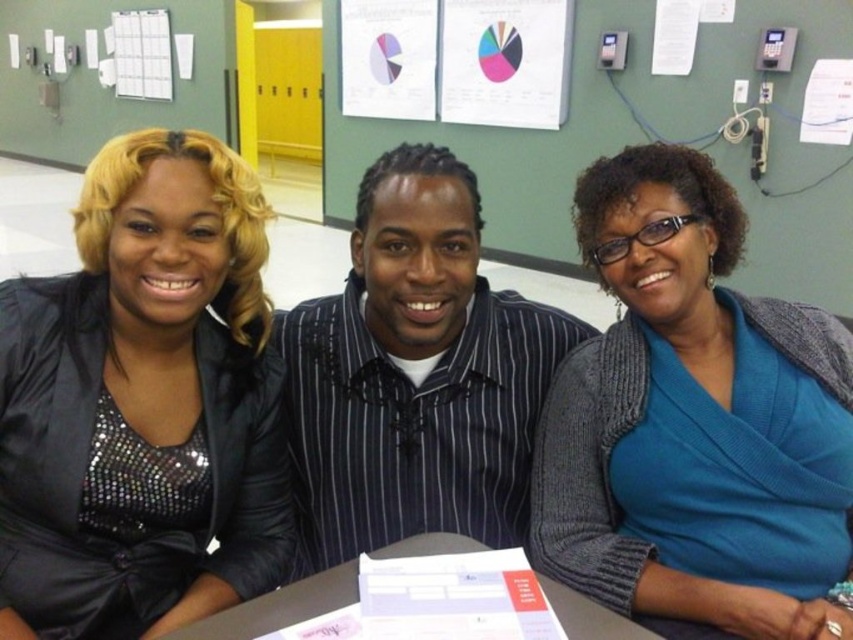
Which of these two, satin black jacket at left or black pinstripe shirt at center, stands shorter?

satin black jacket at left is shorter.

Which is more to the left, satin black jacket at left or black pinstripe shirt at center?

satin black jacket at left

Who is more forward, [260,481] or [408,348]?

Point [260,481]

This screenshot has width=853, height=640. I want to click on satin black jacket at left, so click(x=143, y=401).

Is blue knit sweater at center to the right of black pinstripe shirt at center from the viewer's perspective?

Yes, blue knit sweater at center is to the right of black pinstripe shirt at center.

Is blue knit sweater at center bigger than black pinstripe shirt at center?

Actually, blue knit sweater at center might be smaller than black pinstripe shirt at center.

Which is in front, point (554, 490) or point (352, 269)?

Point (554, 490) is more forward.

Identify the location of blue knit sweater at center. (689, 419).

Which is more to the left, satin black jacket at left or white paper at center?

satin black jacket at left

Does satin black jacket at left lie in front of white paper at center?

No, it is behind white paper at center.

Image resolution: width=853 pixels, height=640 pixels. What do you see at coordinates (143, 401) in the screenshot?
I see `satin black jacket at left` at bounding box center [143, 401].

I want to click on satin black jacket at left, so click(143, 401).